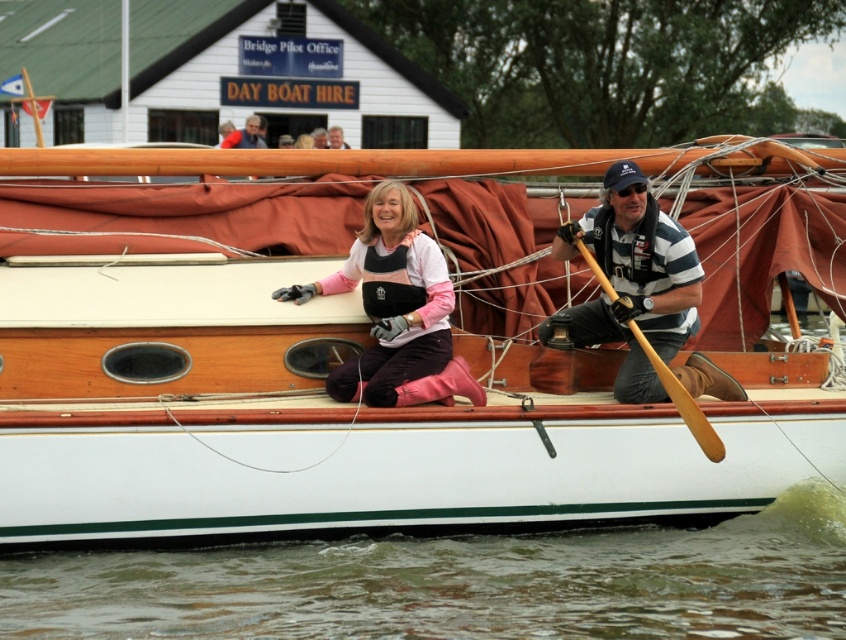
Question: Among these objects, which one is nearest to the camera?

Choices:
 (A) white wood boat at center
 (B) wooden paddle at right

Answer: (B)

Question: Among these objects, which one is nearest to the camera?

Choices:
 (A) smooth brown leather jacket at upper center
 (B) wooden paddle at right

Answer: (B)

Question: Does white wood boat at center appear on the left side of greenish murky water at lower center?

Choices:
 (A) no
 (B) yes

Answer: (A)

Question: Does pink rubber boots at center have a greater width compared to smooth brown leather jacket at upper center?

Choices:
 (A) yes
 (B) no

Answer: (A)

Question: Estimate the real-world distances between objects in this image. Which object is farther from the white wood boat at center?

Choices:
 (A) pink rubber boots at center
 (B) smooth brown leather jacket at upper center
 (C) wooden paddle at right
 (D) greenish murky water at lower center

Answer: (B)

Question: Does pink rubber boots at center have a greater width compared to smooth brown leather jacket at upper center?

Choices:
 (A) no
 (B) yes

Answer: (B)